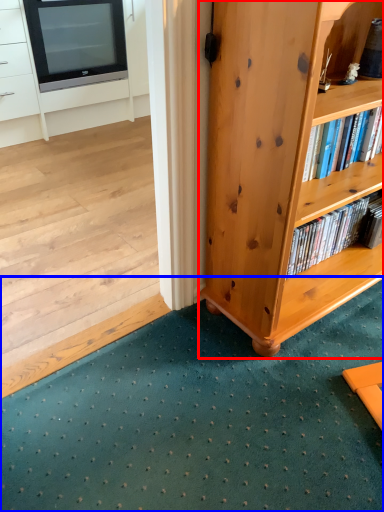
Question: Which object is closer to the camera taking this photo, bookcase (highlighted by a red box) or doormat (highlighted by a blue box)?

Choices:
 (A) bookcase
 (B) doormat

Answer: (B)